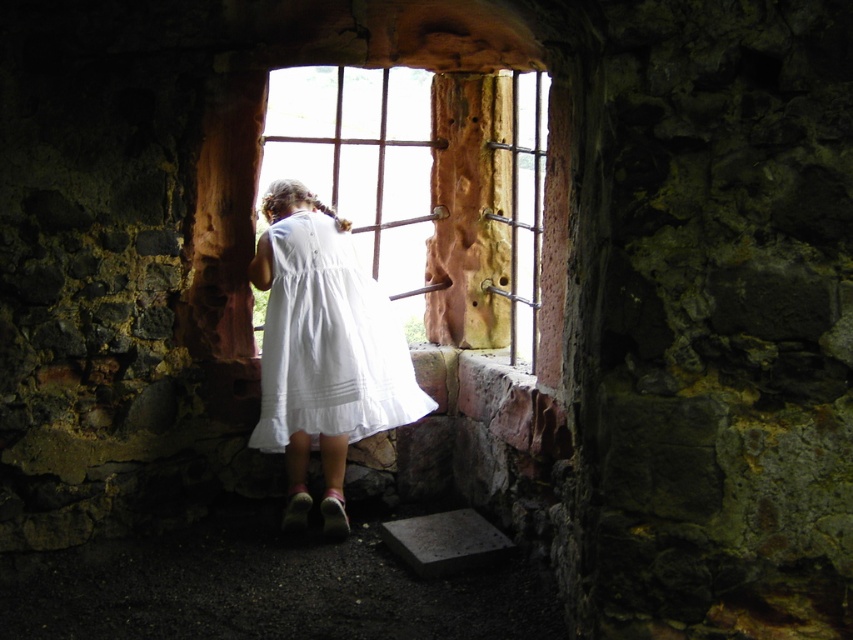
Is wooden at center above white cotton dress at center?

Yes.

Does wooden at center have a lesser height compared to white cotton dress at center?

No, wooden at center is not shorter than white cotton dress at center.

Which is in front, point (480, 195) or point (296, 406)?

Point (296, 406) is in front.

In order to click on wooden at center in this screenshot , I will do `click(456, 202)`.